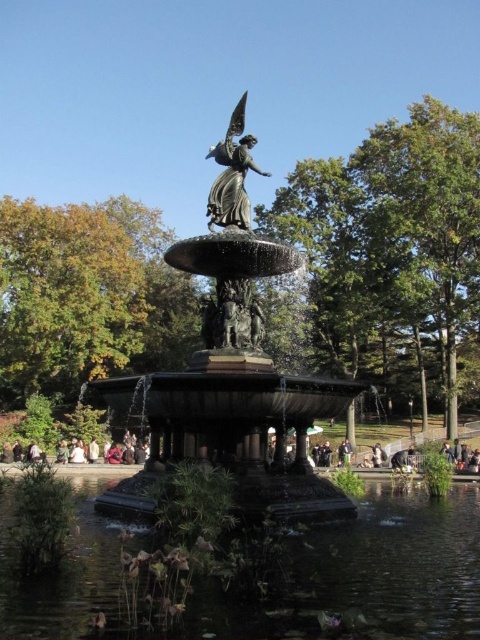
Which is above, bronze statue at center or polished bronze statue at center?

Positioned higher is polished bronze statue at center.

Is bronze statue at center above polished bronze statue at center?

Incorrect, bronze statue at center is not positioned above polished bronze statue at center.

Between point (292, 481) and point (248, 148), which one is positioned behind?

The point (248, 148) is more distant.

Find the location of a particular element. The width and height of the screenshot is (480, 640). bronze statue at center is located at coordinates (230, 374).

Describe the element at coordinates (371, 573) in the screenshot. I see `clear water at fountain center` at that location.

Does clear water at fountain center have a greater height compared to polished bronze statue at center?

Incorrect, clear water at fountain center's height is not larger of polished bronze statue at center's.

Locate an element on the screen. The height and width of the screenshot is (640, 480). clear water at fountain center is located at coordinates (371, 573).

Who is more distant from viewer, (247, 273) or (116, 577)?

Point (247, 273)

The width and height of the screenshot is (480, 640). Describe the element at coordinates (230, 374) in the screenshot. I see `bronze statue at center` at that location.

This screenshot has width=480, height=640. Identify the location of bronze statue at center. (230, 374).